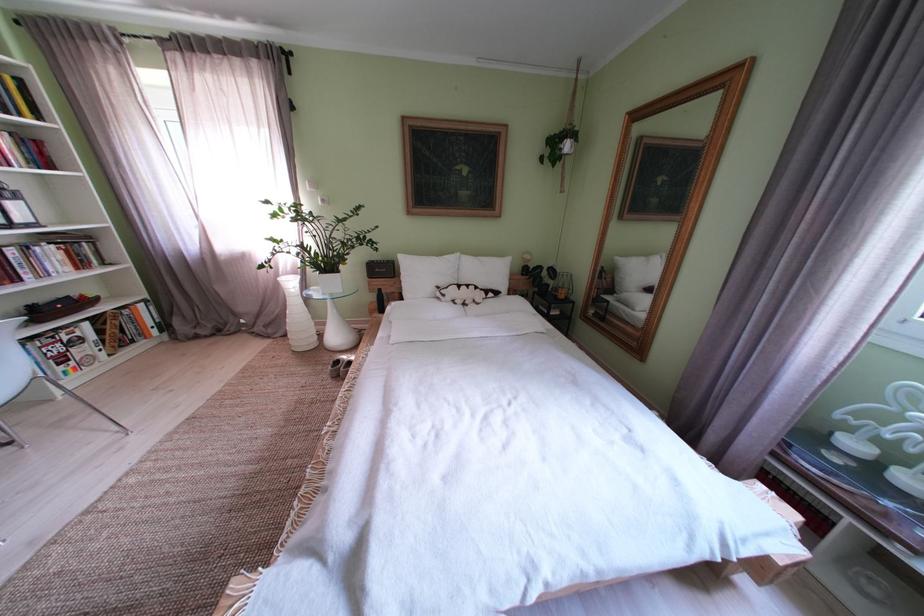
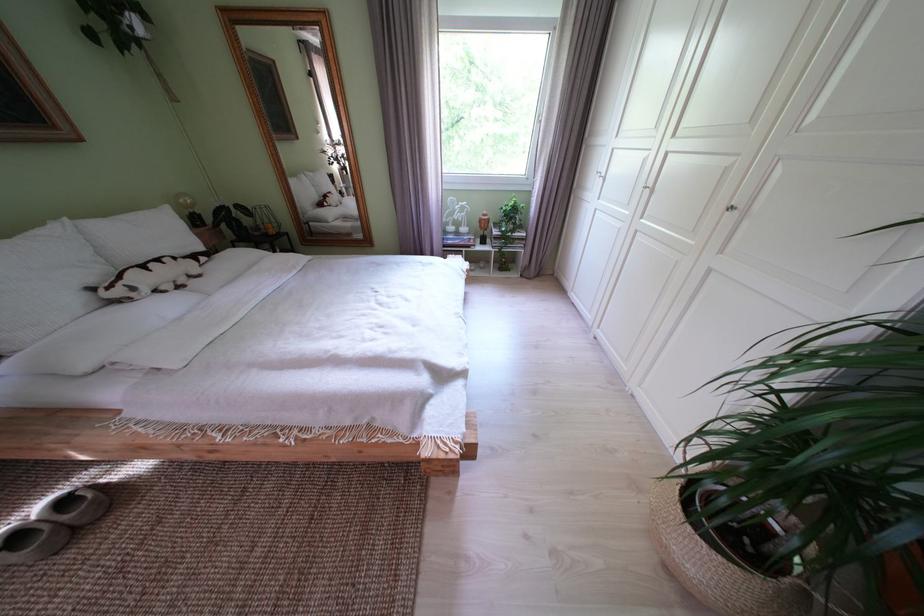
The point at (455, 301) is marked in the first image. Where is the corresponding point in the second image?

(146, 294)